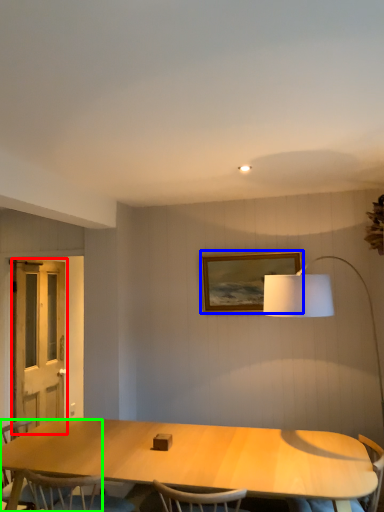
Question: Which is farther away from screen door (highlighted by a red box)? picture frame (highlighted by a blue box) or chair (highlighted by a green box)?

Choices:
 (A) picture frame
 (B) chair

Answer: (A)